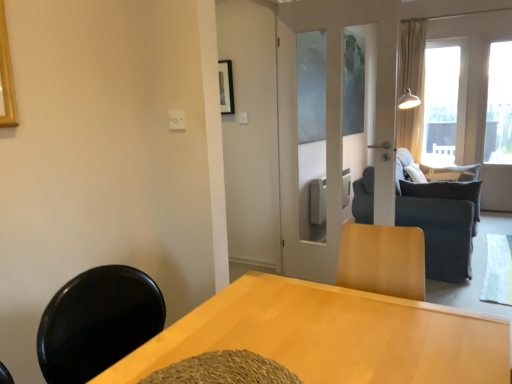
Locate an element on the screen. The width and height of the screenshot is (512, 384). light wood table at center is located at coordinates (332, 335).

You are a GUI agent. You are given a task and a screenshot of the screen. Output one action in this format:
    pyautogui.click(x=<x>, y=<y>)
    Task: Click on the transparent glass window at upper right, which appears as the second window when viewed from the right
    The image size is (512, 384).
    Given the screenshot: What is the action you would take?
    pyautogui.click(x=441, y=104)

Considering the sizes of objects transparent glass window at upper right, which appears as the second window when viewed from the right, and light wood table at center in the image provided, who is thinner, transparent glass window at upper right, which appears as the second window when viewed from the right, or light wood table at center?

Thinner between the two is transparent glass window at upper right, which appears as the second window when viewed from the right.

Are transparent glass window at upper right, marked as the first window in a left-to-right arrangement, and light wood table at center making contact?

transparent glass window at upper right, marked as the first window in a left-to-right arrangement, and light wood table at center are clearly separated.

Identify the location of the 2nd window directly above the light wood table at center (from a real-world perspective). (441, 104).

Is the depth of transparent glass window at upper right, which appears as the second window when viewed from the right, less than that of light wood table at center?

No, it is not.

How many degrees apart are the facing directions of dark gray fabric couch at center and beige fabric curtain at right?

dark gray fabric couch at center and beige fabric curtain at right are facing 92.6 degrees away from each other.

Considering their positions, is dark gray fabric couch at center located in front of or behind beige fabric curtain at right?

dark gray fabric couch at center is positioned closer to the viewer than beige fabric curtain at right.

Between dark gray fabric couch at center and beige fabric curtain at right, which one has smaller size?

Smaller between the two is beige fabric curtain at right.

Is dark gray fabric couch at center oriented towards beige fabric curtain at right?

No, dark gray fabric couch at center is not aimed at beige fabric curtain at right.

Based on the photo, between dark gray fabric pillow at right and transparent glass door at upper right, positioned as the 1th window in right-to-left order, which one has less height?

dark gray fabric pillow at right is shorter.

In terms of size, does dark gray fabric pillow at right appear bigger or smaller than transparent glass door at upper right, which is the second window from left to right?

In the image, dark gray fabric pillow at right appears to be larger than transparent glass door at upper right, which is the second window from left to right.

From a real-world perspective, is dark gray fabric pillow at right on top of transparent glass door at upper right, positioned as the 1th window in right-to-left order?

No, from a real-world perspective, dark gray fabric pillow at right is not over transparent glass door at upper right, positioned as the 1th window in right-to-left order

Are dark gray fabric pillow at right and transparent glass door at upper right, which is the second window from left to right, located far from each other?

dark gray fabric pillow at right is positioned a significant distance from transparent glass door at upper right, which is the second window from left to right.

Relative to transparent glass window at upper right, which appears as the second window when viewed from the right, is transparent glass door at upper right, which is the second window from left to right, in front or behind?

Clearly, transparent glass door at upper right, which is the second window from left to right, is in front of transparent glass window at upper right, which appears as the second window when viewed from the right.

Is transparent glass door at upper right, positioned as the 1th window in right-to-left order, positioned with its back to transparent glass window at upper right, marked as the first window in a left-to-right arrangement?

No.

From the image's perspective, is transparent glass door at upper right, positioned as the 1th window in right-to-left order, under transparent glass window at upper right, marked as the first window in a left-to-right arrangement?

Indeed, from the image's perspective, transparent glass door at upper right, positioned as the 1th window in right-to-left order, is shown beneath transparent glass window at upper right, marked as the first window in a left-to-right arrangement.

The image size is (512, 384). Identify the location of window in front of the transparent glass window at upper right, marked as the first window in a left-to-right arrangement. (499, 105).

Which object is more forward, beige fabric curtain at right or transparent glass door at upper right, which is the second window from left to right?

Positioned in front is transparent glass door at upper right, which is the second window from left to right.

Is beige fabric curtain at right oriented towards transparent glass door at upper right, which is the second window from left to right?

No, beige fabric curtain at right is not facing towards transparent glass door at upper right, which is the second window from left to right.

Does beige fabric curtain at right have a lesser height compared to transparent glass door at upper right, which is the second window from left to right?

Correct, beige fabric curtain at right is not as tall as transparent glass door at upper right, which is the second window from left to right.

Is beige fabric curtain at right far from transparent glass door at upper right, which is the second window from left to right?

No.

How many degrees apart are the facing directions of dark gray fabric pillow at right and light wood table at center?

dark gray fabric pillow at right and light wood table at center are facing 87.1 degrees away from each other.

From the image's perspective, is dark gray fabric pillow at right above or below light wood table at center?

Based on their image positions, dark gray fabric pillow at right is located above light wood table at center.

Can you confirm if dark gray fabric pillow at right is positioned to the left of light wood table at center?

Incorrect, dark gray fabric pillow at right is not on the left side of light wood table at center.

Considering the relative sizes of beige fabric curtain at right and dark gray fabric pillow at right in the image provided, is beige fabric curtain at right shorter than dark gray fabric pillow at right?

No.

Does beige fabric curtain at right have a larger size compared to dark gray fabric pillow at right?

Yes.

Identify the location of curtain on the right of dark gray fabric pillow at right. The height and width of the screenshot is (384, 512). (411, 85).

Does beige fabric curtain at right have a greater width compared to dark gray fabric pillow at right?

In fact, beige fabric curtain at right might be narrower than dark gray fabric pillow at right.

Locate an element on the screen. The height and width of the screenshot is (384, 512). table located in front of the transparent glass window at upper right, marked as the first window in a left-to-right arrangement is located at coordinates (332, 335).

Locate an element on the screen. This screenshot has height=384, width=512. curtain that appears behind the dark gray fabric couch at center is located at coordinates (411, 85).

Estimate the real-world distances between objects in this image. Which object is further from dark gray fabric pillow at right, transparent glass window at upper right, marked as the first window in a left-to-right arrangement, or light wood table at center?

Based on the image, transparent glass window at upper right, marked as the first window in a left-to-right arrangement, appears to be further to dark gray fabric pillow at right.

Looking at the image, which one is located closer to dark gray fabric pillow at right, transparent glass door at upper right, which is the second window from left to right, or dark gray fabric couch at center?

dark gray fabric couch at center lies closer to dark gray fabric pillow at right than the other object.

Looking at the image, which one is located further to beige fabric curtain at right, light wood table at center or transparent glass window at upper right, marked as the first window in a left-to-right arrangement?

light wood table at center.

From the image, which object appears to be farther from dark gray fabric pillow at right, transparent glass door at upper right, positioned as the 1th window in right-to-left order, or light wood table at center?

transparent glass door at upper right, positioned as the 1th window in right-to-left order, is positioned further to the anchor dark gray fabric pillow at right.

Considering their positions, is dark gray fabric pillow at right positioned closer to transparent glass door at upper right, positioned as the 1th window in right-to-left order, than dark gray fabric couch at center?

dark gray fabric pillow at right is positioned closer to the anchor transparent glass door at upper right, positioned as the 1th window in right-to-left order.

From the picture: Based on their spatial positions, is dark gray fabric couch at center or transparent glass window at upper right, marked as the first window in a left-to-right arrangement, further from beige fabric curtain at right?

The object further to beige fabric curtain at right is dark gray fabric couch at center.

Estimate the real-world distances between objects in this image. Which object is closer to light wood table at center, dark gray fabric pillow at right or beige fabric curtain at right?

dark gray fabric pillow at right lies closer to light wood table at center than the other object.

Which object lies further to the anchor point transparent glass window at upper right, which appears as the second window when viewed from the right, light wood table at center or dark gray fabric couch at center?

Among the two, light wood table at center is located further to transparent glass window at upper right, which appears as the second window when viewed from the right.

Find the location of a particular element. This screenshot has width=512, height=384. window between dark gray fabric couch at center and transparent glass window at upper right, which appears as the second window when viewed from the right, from front to back is located at coordinates (499, 105).

At what (x,y) coordinates should I click in order to perform the action: click on pillow located between light wood table at center and beige fabric curtain at right in the depth direction. Please return your answer as a coordinate pair (x, y). Looking at the image, I should click on (445, 192).

Identify the location of pillow positioned between light wood table at center and transparent glass door at upper right, positioned as the 1th window in right-to-left order, from near to far. Image resolution: width=512 pixels, height=384 pixels. (445, 192).

You are a GUI agent. You are given a task and a screenshot of the screen. Output one action in this format:
    pyautogui.click(x=<x>, y=<y>)
    Task: Click on the curtain between dark gray fabric couch at center and transparent glass window at upper right, which appears as the second window when viewed from the right, along the z-axis
    
    Given the screenshot: What is the action you would take?
    pyautogui.click(x=411, y=85)